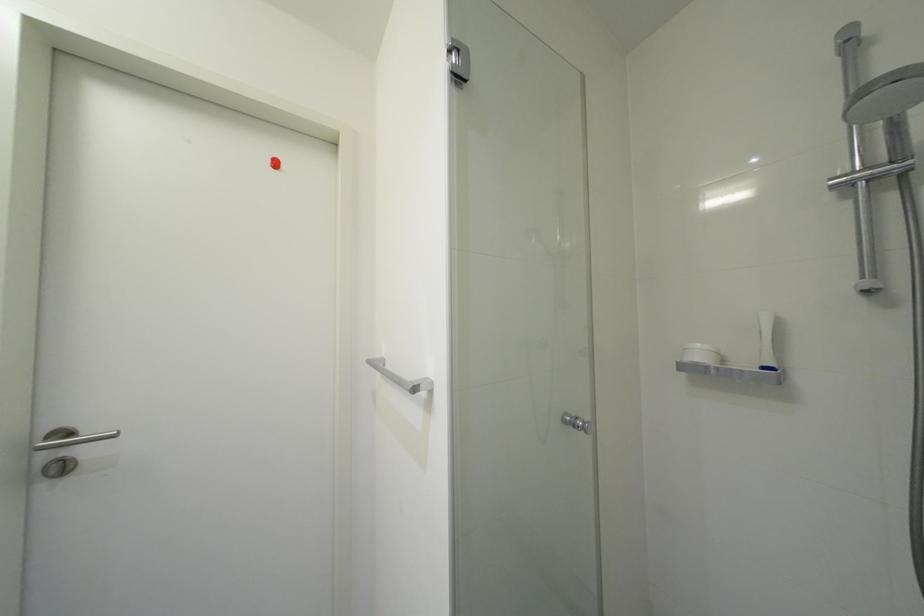
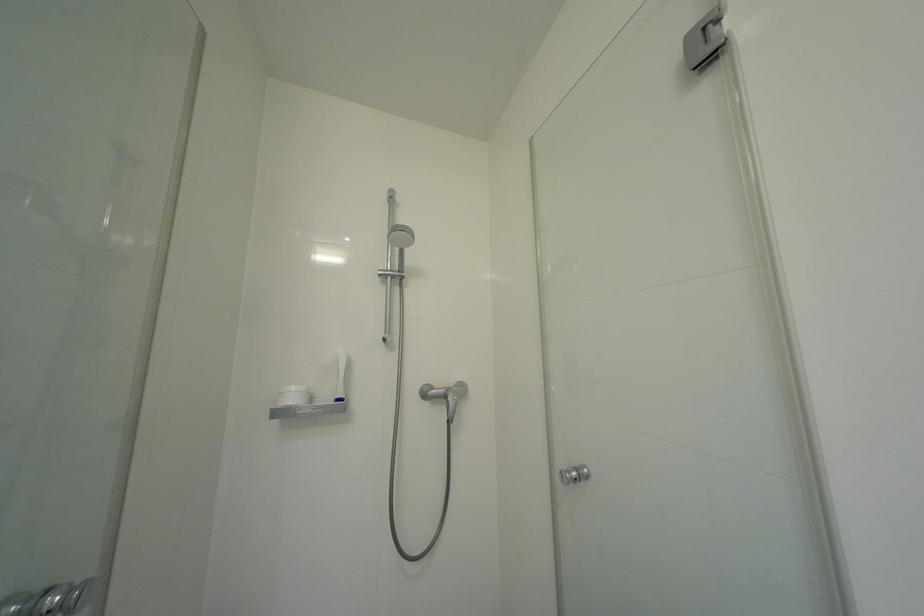
Question: How did the camera likely rotate?

Choices:
 (A) Left
 (B) Right
 (C) Up
 (D) Down

Answer: (B)